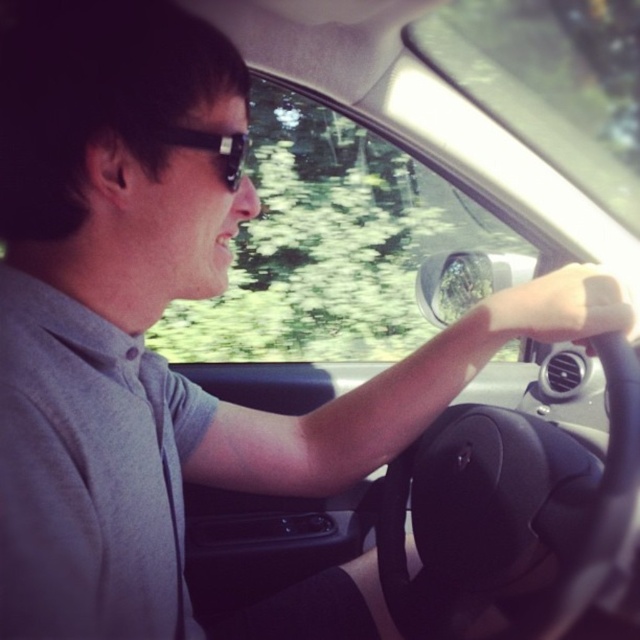
Question: Among these objects, which one is farthest from the camera?

Choices:
 (A) slightly translucent skin at steering wheel center
 (B) black rubber steering wheel at center
 (C) black plastic sunglasses at upper center

Answer: (A)

Question: Is the position of slightly translucent skin at steering wheel center less distant than that of black plastic sunglasses at upper center?

Choices:
 (A) no
 (B) yes

Answer: (A)

Question: Among these objects, which one is nearest to the camera?

Choices:
 (A) slightly translucent skin at steering wheel center
 (B) black plastic sunglasses at upper center
 (C) black rubber steering wheel at center

Answer: (B)

Question: Which object appears closest to the camera in this image?

Choices:
 (A) black plastic sunglasses at upper center
 (B) slightly translucent skin at steering wheel center
 (C) black rubber steering wheel at center

Answer: (A)

Question: Is slightly translucent skin at steering wheel center below black plastic sunglasses at upper center?

Choices:
 (A) yes
 (B) no

Answer: (A)

Question: Can you confirm if black rubber steering wheel at center is positioned to the left of slightly translucent skin at steering wheel center?

Choices:
 (A) no
 (B) yes

Answer: (B)